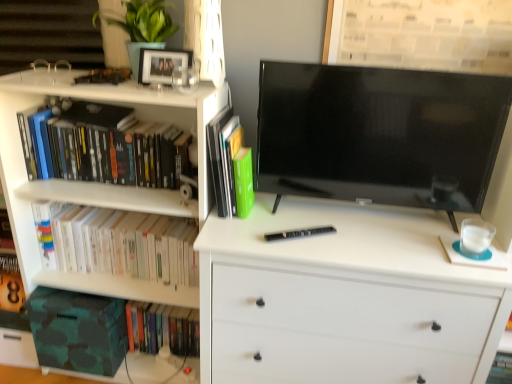
The image size is (512, 384). Find the location of `green matte book at center, which is counted as the 2th book, starting from the top`. green matte book at center, which is counted as the 2th book, starting from the top is located at coordinates (224, 158).

Where is `camouflage fabric storage box at lower left`? The height and width of the screenshot is (384, 512). camouflage fabric storage box at lower left is located at coordinates 78,330.

What is the approximate width of black matte pen at center?

The width of black matte pen at center is 9.33 inches.

What is the approximate height of hardcover books at left, which is the 1th book from top to bottom?

The height of hardcover books at left, which is the 1th book from top to bottom, is 11.24 inches.

Describe the element at coordinates (123, 244) in the screenshot. I see `white paperbacks at left, the 3th book in the top-to-bottom sequence` at that location.

How much space does hardcover book at lower left, marked as the 4th book in a top-to-bottom arrangement, occupy horizontally?

hardcover book at lower left, marked as the 4th book in a top-to-bottom arrangement, is 6.38 inches in width.

What do you see at coordinates (162, 328) in the screenshot? The height and width of the screenshot is (384, 512). I see `hardcover book at lower left, which is the 1th book in bottom-to-top order` at bounding box center [162, 328].

Where is `matte black picture frame at upper center`? The image size is (512, 384). matte black picture frame at upper center is located at coordinates (162, 64).

Is point (41, 128) in front of point (298, 235)?

No, (41, 128) is further to viewer.

Is hardcover books at left, the 4th book positioned from the bottom, facing away from black matte pen at center?

No, hardcover books at left, the 4th book positioned from the bottom, is not facing away from black matte pen at center.

From the image's perspective, is hardcover books at left, which is the 1th book from top to bottom, above black matte pen at center?

Yes, from the image's perspective, hardcover books at left, which is the 1th book from top to bottom, is above black matte pen at center.

Is hardcover books at left, the 4th book positioned from the bottom, spatially inside black matte pen at center, or outside of it?

hardcover books at left, the 4th book positioned from the bottom, is outside black matte pen at center.

Considering the positions of objects green matte book at center, which is counted as the 2th book, starting from the top, and hardcover books at left, which is the 1th book from top to bottom, in the image provided, who is in front, green matte book at center, which is counted as the 2th book, starting from the top, or hardcover books at left, which is the 1th book from top to bottom,?

green matte book at center, which is counted as the 2th book, starting from the top, is more forward.

From a real-world perspective, relative to hardcover books at left, the 4th book positioned from the bottom, is green matte book at center, which is counted as the 2th book, starting from the top, vertically above or below?

In terms of real-world spatial position, green matte book at center, which is counted as the 2th book, starting from the top, is above hardcover books at left, the 4th book positioned from the bottom.

There is a hardcover books at left, which is the 1th book from top to bottom. At what (x,y) coordinates should I click in order to perform the action: click on book above it (from a real-world perspective). Please return your answer as a coordinate pair (x, y). The image size is (512, 384). Looking at the image, I should click on (224, 158).

In the scene shown: Considering the relative sizes of green matte book at center, which is counted as the 2th book, starting from the top, and hardcover books at left, which is the 1th book from top to bottom, in the image provided, is green matte book at center, which is counted as the 2th book, starting from the top, bigger than hardcover books at left, which is the 1th book from top to bottom,?

Actually, green matte book at center, which is counted as the 2th book, starting from the top, might be smaller than hardcover books at left, which is the 1th book from top to bottom.

Does white matte chest of drawers at center appear on the left side of hardcover book at lower left, which is the 1th book in bottom-to-top order?

No.

In the scene shown: Is white matte chest of drawers at center oriented towards hardcover book at lower left, which is the 1th book in bottom-to-top order?

No, white matte chest of drawers at center is not oriented towards hardcover book at lower left, which is the 1th book in bottom-to-top order.

From the picture: Is white matte chest of drawers at center wider than hardcover book at lower left, marked as the 4th book in a top-to-bottom arrangement?

Yes.

From the image's perspective, is white paperbacks at left, the 3th book in the top-to-bottom sequence, below green matte book at center, which is the third book from bottom to top?

Yes, from the image's perspective, white paperbacks at left, the 3th book in the top-to-bottom sequence, is beneath green matte book at center, which is the third book from bottom to top.

Is white paperbacks at left, the second book when ordered from bottom to top, to the left of green matte book at center, which is the third book from bottom to top, from the viewer's perspective?

Yes, white paperbacks at left, the second book when ordered from bottom to top, is to the left of green matte book at center, which is the third book from bottom to top.

From a real-world perspective, which is physically above, white paperbacks at left, the second book when ordered from bottom to top, or green matte book at center, which is the third book from bottom to top?

In real-world perspective, green matte book at center, which is the third book from bottom to top, is above.

Could you tell me if white paperbacks at left, the 3th book in the top-to-bottom sequence, is turned towards green matte book at center, which is counted as the 2th book, starting from the top?

No, white paperbacks at left, the 3th book in the top-to-bottom sequence, is not aimed at green matte book at center, which is counted as the 2th book, starting from the top.

Is white paperbacks at left, the second book when ordered from bottom to top, taller or shorter than white matte chest of drawers at center?

Considering their sizes, white paperbacks at left, the second book when ordered from bottom to top, has less height than white matte chest of drawers at center.

Based on the photo, which of these two, white paperbacks at left, the 3th book in the top-to-bottom sequence, or white matte chest of drawers at center, is wider?

white matte chest of drawers at center is wider.

From the image's perspective, is white paperbacks at left, the second book when ordered from bottom to top, positioned above or below white matte chest of drawers at center?

Clearly, from the image's perspective, white paperbacks at left, the second book when ordered from bottom to top, is above white matte chest of drawers at center.

Measure the distance between white paperbacks at left, the 3th book in the top-to-bottom sequence, and white matte chest of drawers at center.

54.15 centimeters.

Does black matte pen at center contain black glossy tv at center?

Definitely not — black glossy tv at center is not inside black matte pen at center.

Considering the relative positions of black matte pen at center and black glossy tv at center in the image provided, is black matte pen at center to the left or to the right of black glossy tv at center?

black matte pen at center is to the left of black glossy tv at center.

Which of these two, black matte pen at center or black glossy tv at center, stands taller?

With more height is black glossy tv at center.

From a real-world perspective, between black matte pen at center and black glossy tv at center, who is vertically higher?

From a 3D spatial view, black glossy tv at center is above.

Is point (288, 139) positioned after point (255, 221)?

That is False.

Is black glossy tv at center outside of white matte chest of drawers at center?

Indeed, black glossy tv at center is completely outside white matte chest of drawers at center.

Is black glossy tv at center positioned far away from white matte chest of drawers at center?

black glossy tv at center is near white matte chest of drawers at center, not far away.

From a real-world perspective, which is physically below, black glossy tv at center or white matte chest of drawers at center?

In real-world perspective, white matte chest of drawers at center is lower.

This screenshot has height=384, width=512. Find the location of `paperback book that appears below the hardcover books at left, which is the 1th book from top to bottom (from a real-world perspective)`. paperback book that appears below the hardcover books at left, which is the 1th book from top to bottom (from a real-world perspective) is located at coordinates (298, 233).

Image resolution: width=512 pixels, height=384 pixels. In the image, there is a green matte book at center, which is counted as the 2th book, starting from the top. What are the coordinates of `book above it (from the image's perspective)` in the screenshot? It's located at (103, 146).

From the image, which object appears to be farther from white paperbacks at left, the second book when ordered from bottom to top, black matte pen at center or hardcover books at left, which is the 1th book from top to bottom?

Among the two, black matte pen at center is located further to white paperbacks at left, the second book when ordered from bottom to top.

Estimate the real-world distances between objects in this image. Which object is further from black matte pen at center, hardcover book at lower left, which is the 1th book in bottom-to-top order, or matte black picture frame at upper center?

hardcover book at lower left, which is the 1th book in bottom-to-top order, is positioned further to the anchor black matte pen at center.

Based on their spatial positions, is green matte book at center, which is counted as the 2th book, starting from the top, or black matte pen at center closer to black glossy tv at center?

black matte pen at center is closer to black glossy tv at center.

Estimate the real-world distances between objects in this image. Which object is closer to black glossy tv at center, hardcover books at left, which is the 1th book from top to bottom, or camouflage fabric storage box at lower left?

The object closer to black glossy tv at center is hardcover books at left, which is the 1th book from top to bottom.

When comparing their distances from white paperbacks at left, the second book when ordered from bottom to top, does camouflage fabric storage box at lower left or white matte chest of drawers at center seem further?

white matte chest of drawers at center.

Estimate the real-world distances between objects in this image. Which object is closer to hardcover books at left, which is the 1th book from top to bottom, matte black picture frame at upper center or black matte pen at center?

Based on the image, matte black picture frame at upper center appears to be nearer to hardcover books at left, which is the 1th book from top to bottom.

Based on their spatial positions, is white matte chest of drawers at center or green matte book at center, which is counted as the 2th book, starting from the top, further from black matte pen at center?

green matte book at center, which is counted as the 2th book, starting from the top.

Based on their spatial positions, is white matte chest of drawers at center or black glossy tv at center further from matte black picture frame at upper center?

The object further to matte black picture frame at upper center is white matte chest of drawers at center.

Identify the location of television between matte black picture frame at upper center and hardcover book at lower left, which is the 1th book in bottom-to-top order, in the vertical direction. The width and height of the screenshot is (512, 384). (379, 134).

Find the location of `the chest of drawers between matte black picture frame at upper center and camouflage fabric storage box at lower left vertically`. the chest of drawers between matte black picture frame at upper center and camouflage fabric storage box at lower left vertically is located at coordinates (344, 298).

What are the coordinates of `picture frame between camouflage fabric storage box at lower left and black glossy tv at center in the horizontal direction` in the screenshot? It's located at (162, 64).

I want to click on paperback book between green matte book at center, which is counted as the 2th book, starting from the top, and black glossy tv at center, in the horizontal direction, so click(x=298, y=233).